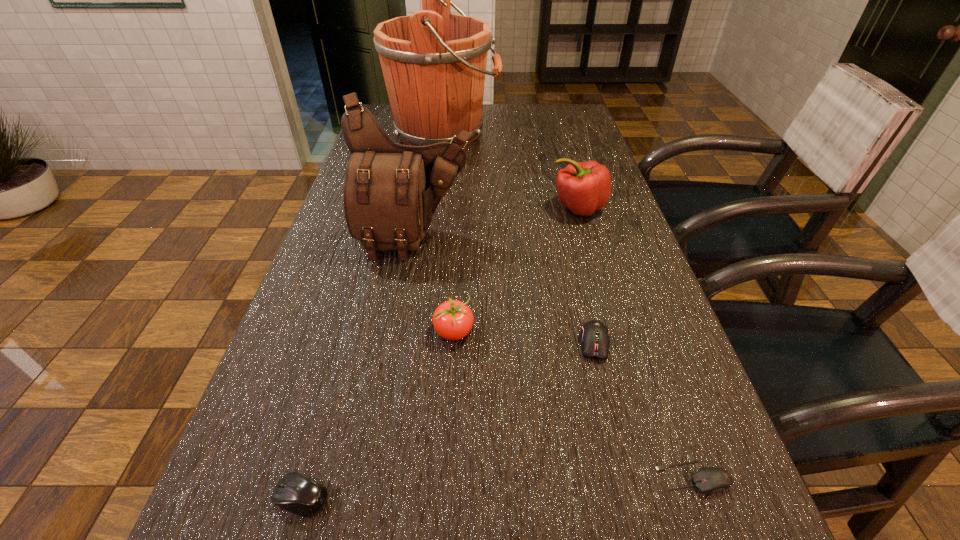
Where is `vacant area between the shortest mouse and the fourth tallest object`? vacant area between the shortest mouse and the fourth tallest object is located at coordinates (574, 405).

Identify the location of free space that is in between the farthest mouse and the bell pepper. (587, 275).

Locate which object ranks third in proximity to the tallest object. Please provide its 2D coordinates. Your answer should be formatted as a tuple, i.e. [(x, y)], where the tuple contains the x and y coordinates of a point satisfying the conditions above.

[(453, 320)]

Identify which object is located as the fourth nearest to the bucket. Please provide its 2D coordinates. Your answer should be formatted as a tuple, i.e. [(x, y)], where the tuple contains the x and y coordinates of a point satisfying the conditions above.

[(595, 338)]

Identify the location of the closest mouse relative to the farthest mouse. The image size is (960, 540). (709, 480).

The height and width of the screenshot is (540, 960). Find the location of `mouse that stands as the second closest to the shortest object`. mouse that stands as the second closest to the shortest object is located at coordinates (296, 493).

Where is `vacant point that satisfies the following two spatial constraints: 1. with the handle on the side of the bell pepper; 2. on the right side of the tallest object`? This screenshot has height=540, width=960. vacant point that satisfies the following two spatial constraints: 1. with the handle on the side of the bell pepper; 2. on the right side of the tallest object is located at coordinates (434, 207).

Where is `free point that satisfies the following two spatial constraints: 1. on the back side of the fifth shortest object; 2. on the right side of the leftmost mouse`? free point that satisfies the following two spatial constraints: 1. on the back side of the fifth shortest object; 2. on the right side of the leftmost mouse is located at coordinates (383, 207).

This screenshot has height=540, width=960. Identify the location of free location that satisfies the following two spatial constraints: 1. on the back side of the farthest mouse; 2. with the handle on the side of the bucket. (544, 132).

The image size is (960, 540). In order to click on vacant position in the image that satisfies the following two spatial constraints: 1. on the back side of the third tallest object; 2. on the left side of the second mouse from right to left in this screenshot , I will do click(x=563, y=207).